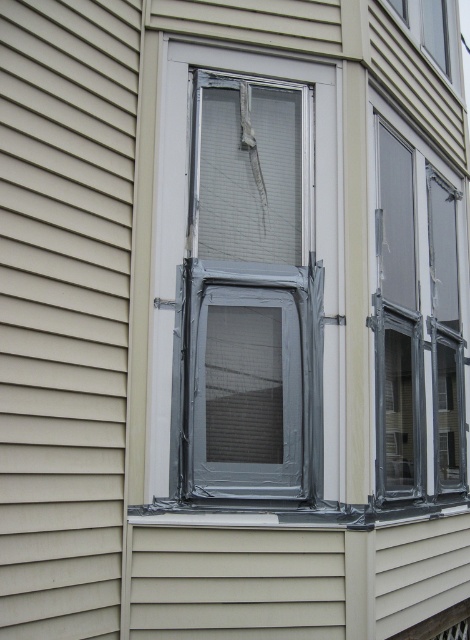
Is metallic silver window frame at center in front of beige siding at center?

No, it is behind beige siding at center.

Is point (169, 170) closer to camera compared to point (59, 586)?

No.

Who is more distant from viewer, (232, 243) or (84, 260)?

The point (232, 243) is behind.

You are a GUI agent. You are given a task and a screenshot of the screen. Output one action in this format:
    pyautogui.click(x=<x>, y=<y>)
    Task: Click on the metallic silver window frame at center
    
    Given the screenshot: What is the action you would take?
    pyautogui.click(x=247, y=282)

Can you confirm if metallic silver window frame at center is positioned below clear plastic window at center?

Incorrect, metallic silver window frame at center is not positioned below clear plastic window at center.

Who is more forward, (211, 248) or (397, 413)?

Point (211, 248)

Does point (173, 458) lie in front of point (409, 157)?

Yes, it is.

This screenshot has height=640, width=470. Find the location of `metallic silver window frame at center`. metallic silver window frame at center is located at coordinates (247, 282).

Does beige siding at center have a smaller size compared to clear plastic window at center?

Yes, beige siding at center is smaller than clear plastic window at center.

Is beige siding at center below clear plastic window at center?

Incorrect, beige siding at center is not positioned below clear plastic window at center.

Is point (132, 202) in front of point (454, 323)?

Yes, it is in front of point (454, 323).

In order to click on beige siding at center in this screenshot , I will do `click(64, 308)`.